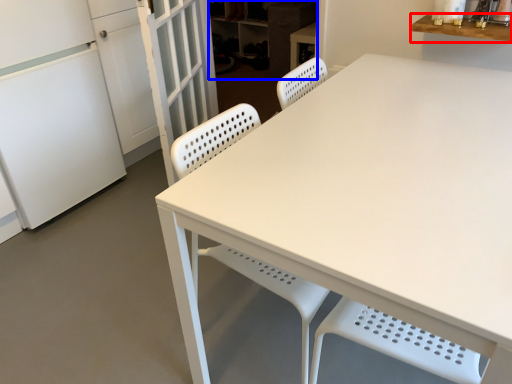
Question: Which point is further to the camera, counter top (highlighted by a red box) or cabinetry (highlighted by a blue box)?

Choices:
 (A) counter top
 (B) cabinetry

Answer: (B)